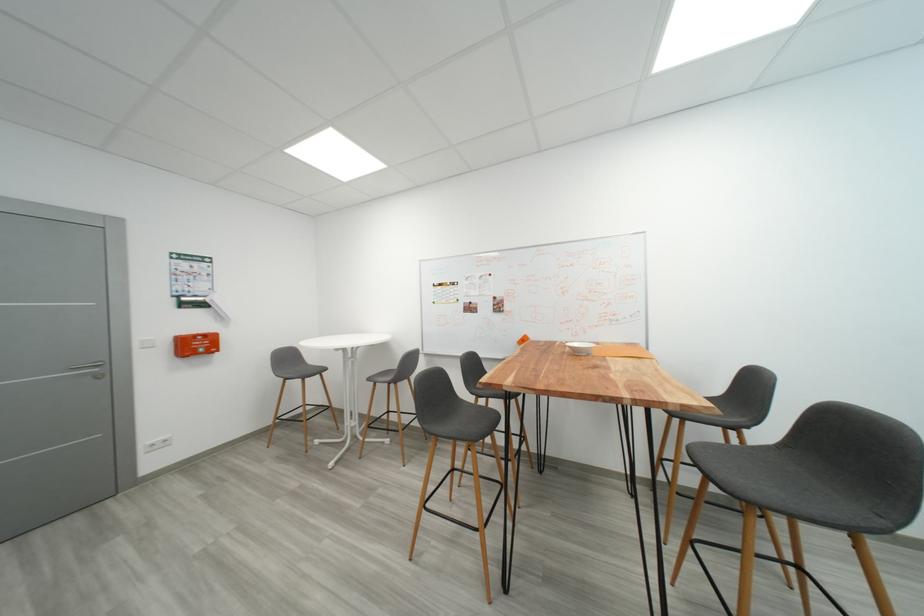
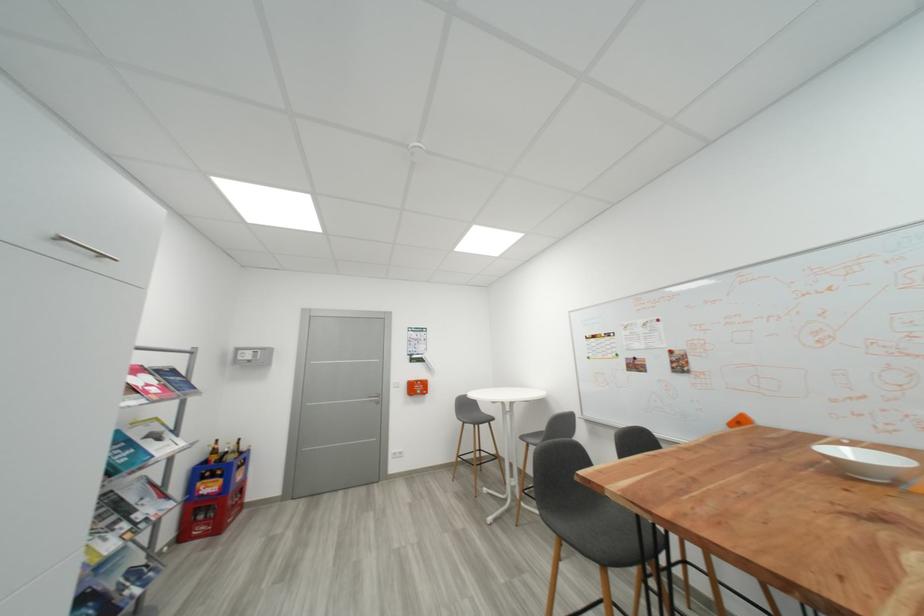
Question: I am providing you with two images of the same scene from different viewpoints. Which of the following objects are not visible in image2?

Choices:
 (A) grey chair sitting surface
 (B) white ceramic bowl
 (C) glass bottle
 (D) none of these

Answer: (D)